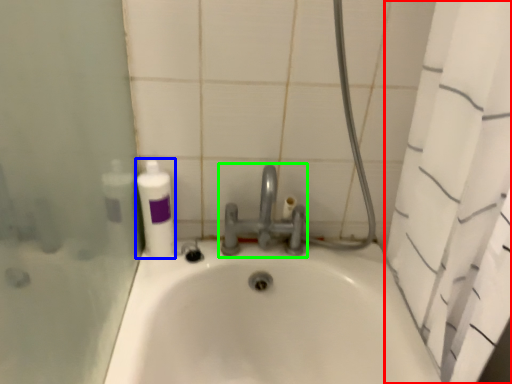
Question: Estimate the real-world distances between objects in this image. Which object is farther from shower curtain (highlighted by a red box), cleaning product (highlighted by a blue box) or tap (highlighted by a green box)?

Choices:
 (A) cleaning product
 (B) tap

Answer: (A)